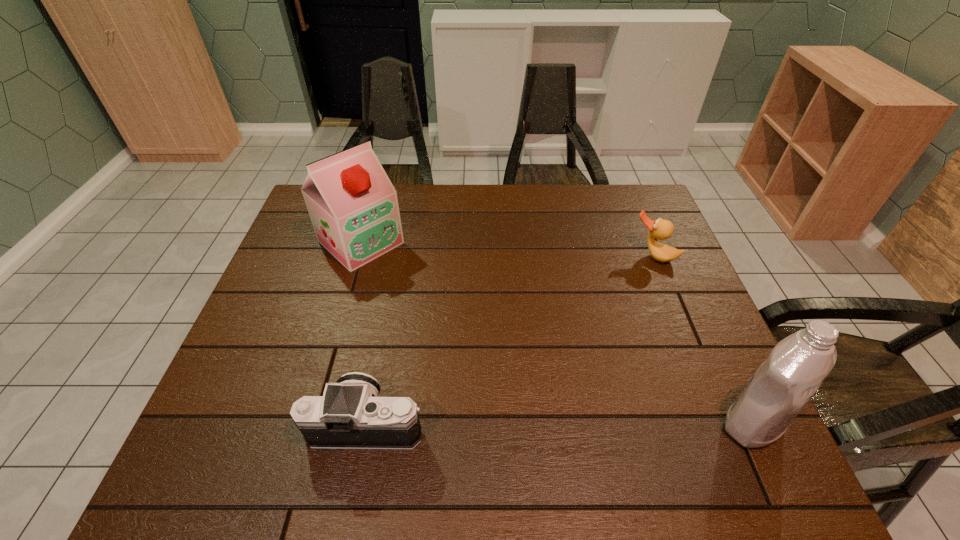
At what (x,y) coordinates should I click in order to perform the action: click on camera. Please return your answer as a coordinate pair (x, y). The height and width of the screenshot is (540, 960). Looking at the image, I should click on (350, 415).

I want to click on detergent, so click(783, 384).

Find the location of a particular element. duck is located at coordinates (660, 229).

This screenshot has height=540, width=960. Find the location of `soya milk`. soya milk is located at coordinates (353, 206).

The image size is (960, 540). I want to click on free space located on the back of the camera, so click(x=385, y=334).

The height and width of the screenshot is (540, 960). Identify the location of vacant region located 0.240m on the left of the detergent. (x=603, y=423).

The width and height of the screenshot is (960, 540). Identify the location of vacant space located on the beak of the shortest object. (588, 360).

At what (x,y) coordinates should I click in order to perform the action: click on free space located on the beak of the shortest object. Please return your answer as a coordinate pair (x, y). Image resolution: width=960 pixels, height=540 pixels. Looking at the image, I should click on (635, 282).

The height and width of the screenshot is (540, 960). In order to click on vacant space located 0.350m on the beak of the shortest object in this screenshot , I will do `click(594, 349)`.

Find the location of a particular element. The width and height of the screenshot is (960, 540). free space located 0.340m with the cap open on the soya milk is located at coordinates (465, 333).